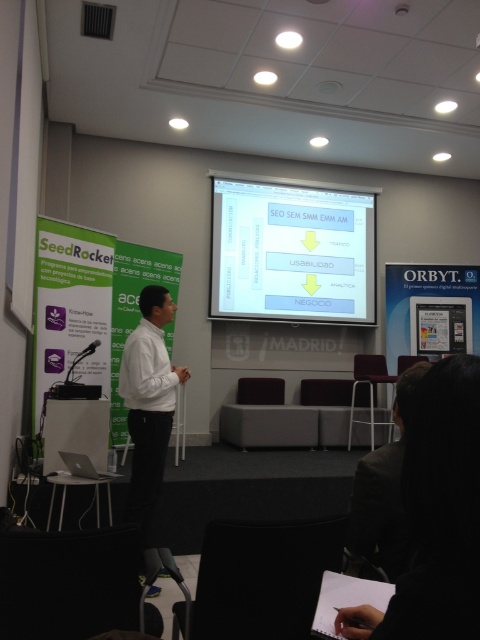
Can you confirm if white glossy projector screen at upper center is wider than white matte shirt at center?

Yes, white glossy projector screen at upper center is wider than white matte shirt at center.

Locate an element on the screen. Image resolution: width=480 pixels, height=640 pixels. white glossy projector screen at upper center is located at coordinates (291, 250).

At what (x,y) coordinates should I click in order to perform the action: click on white glossy projector screen at upper center. Please return your answer as a coordinate pair (x, y). The width and height of the screenshot is (480, 640). Looking at the image, I should click on (291, 250).

How much distance is there between black fabric hair at lower right and white matte shirt at center?

black fabric hair at lower right and white matte shirt at center are 2.51 meters apart.

Can you confirm if black fabric hair at lower right is taller than white matte shirt at center?

No, black fabric hair at lower right is not taller than white matte shirt at center.

Does point (412, 406) come behind point (131, 493)?

No, (412, 406) is in front of (131, 493).

This screenshot has width=480, height=640. Find the location of `black fabric hair at lower right`. black fabric hair at lower right is located at coordinates (435, 515).

Does white glossy projector screen at upper center appear under dark gray suit at lower right?

No, white glossy projector screen at upper center is not below dark gray suit at lower right.

Between white glossy projector screen at upper center and dark gray suit at lower right, which one is positioned higher?

white glossy projector screen at upper center is above.

Between point (252, 243) and point (393, 458), which one is positioned in front?

Point (393, 458) is more forward.

Where is `white glossy projector screen at upper center`? The height and width of the screenshot is (640, 480). white glossy projector screen at upper center is located at coordinates (291, 250).